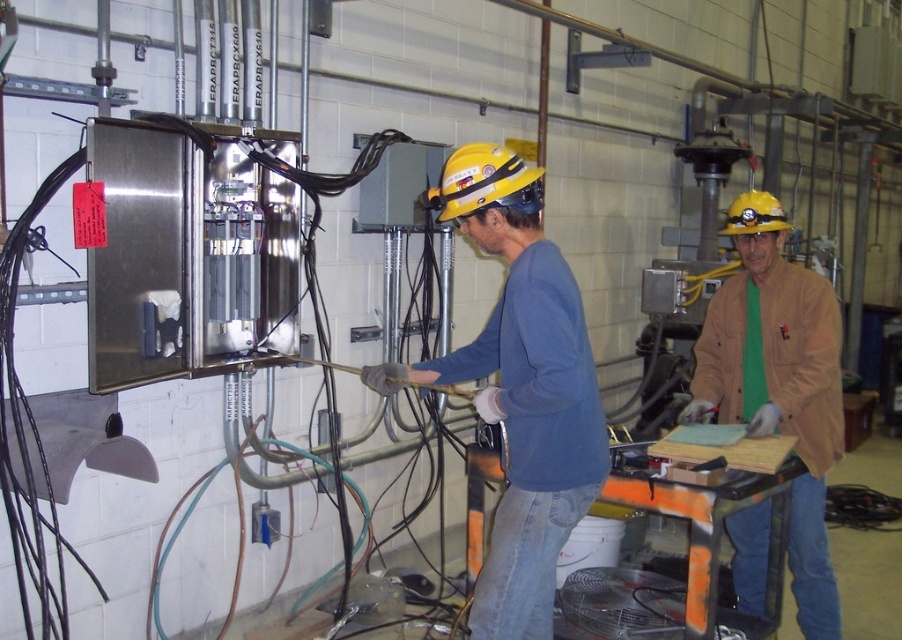
Looking at this image, you are an inspector in this workshop. You need to determine which object is bigger between the brown leather jacket at center and the yellow hard hat at center. Which one is larger?

The brown leather jacket at center is larger in size than the yellow hard hat at center.

You are an inspector in the workshop and need to determine if the blue matte shirt at center can be seen over the brown leather jacket at center from your current position. Based on their heights, what is your conclusion?

The blue matte shirt at center is not as tall as the brown leather jacket at center, so the blue matte shirt at center cannot be seen over the brown leather jacket at center from your current position.

In the workshop scene, there are two workers wearing a blue matte shirt at center and a brown leather jacket at center. Which worker is positioned higher in the image?

The blue matte shirt at center is above the brown leather jacket at center, so the worker in the blue matte shirt at center is positioned higher in the image.